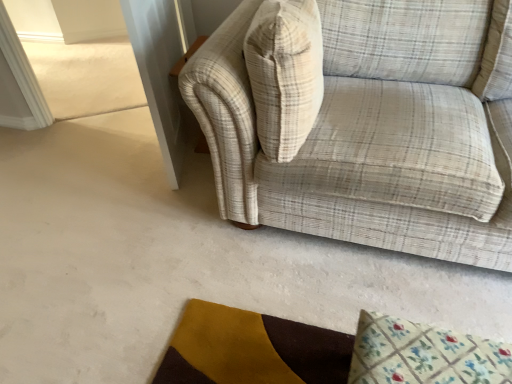
Question: Does beige plaid throw pillow at upper right have a larger size compared to plaid fabric couch at upper right?

Choices:
 (A) no
 (B) yes

Answer: (A)

Question: Does beige plaid throw pillow at upper right appear on the left side of plaid fabric couch at upper right?

Choices:
 (A) yes
 (B) no

Answer: (A)

Question: Does beige plaid throw pillow at upper right have a smaller size compared to plaid fabric couch at upper right?

Choices:
 (A) yes
 (B) no

Answer: (A)

Question: Is beige plaid throw pillow at upper right closer to the viewer compared to plaid fabric couch at upper right?

Choices:
 (A) no
 (B) yes

Answer: (A)

Question: Is beige plaid throw pillow at upper right behind plaid fabric couch at upper right?

Choices:
 (A) yes
 (B) no

Answer: (A)

Question: Based on their sizes in the image, would you say floral fabric mat at lower right is bigger or smaller than beige plaid throw pillow at upper right?

Choices:
 (A) big
 (B) small

Answer: (B)

Question: Is point (473, 367) positioned closer to the camera than point (268, 109)?

Choices:
 (A) closer
 (B) farther

Answer: (A)

Question: From the image's perspective, is floral fabric mat at lower right located above or below beige plaid throw pillow at upper right?

Choices:
 (A) above
 (B) below

Answer: (B)

Question: From a real-world perspective, relative to beige plaid throw pillow at upper right, is floral fabric mat at lower right vertically above or below?

Choices:
 (A) below
 (B) above

Answer: (A)

Question: Is point (286, 23) closer or farther from the camera than point (343, 14)?

Choices:
 (A) closer
 (B) farther

Answer: (A)

Question: In the image, is beige plaid throw pillow at upper right positioned in front of or behind plaid fabric couch at upper right?

Choices:
 (A) behind
 (B) front

Answer: (A)

Question: From a real-world perspective, is beige plaid throw pillow at upper right physically located above or below plaid fabric couch at upper right?

Choices:
 (A) above
 (B) below

Answer: (A)

Question: From the image's perspective, is beige plaid throw pillow at upper right positioned above or below plaid fabric couch at upper right?

Choices:
 (A) below
 (B) above

Answer: (B)

Question: Relative to floral fabric mat at lower right, is plaid fabric couch at upper right in front or behind?

Choices:
 (A) front
 (B) behind

Answer: (A)

Question: Would you say plaid fabric couch at upper right is inside or outside floral fabric mat at lower right?

Choices:
 (A) outside
 (B) inside

Answer: (A)